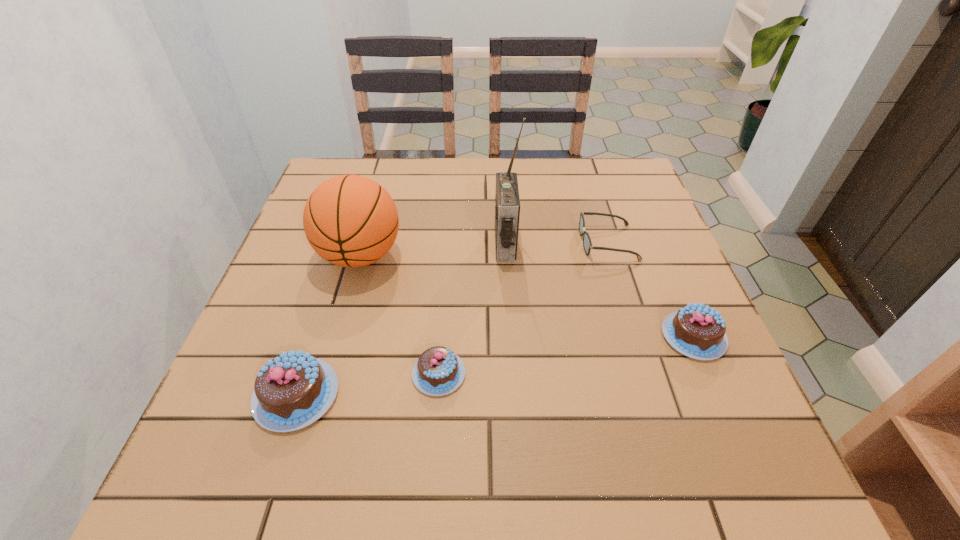
Where is `vacant space that is in between the spectacles and the second tallest chocolate cake`? Image resolution: width=960 pixels, height=540 pixels. vacant space that is in between the spectacles and the second tallest chocolate cake is located at coordinates (651, 289).

Find the location of a particular element. vacant space in between the spectacles and the rightmost chocolate cake is located at coordinates (651, 289).

The width and height of the screenshot is (960, 540). What are the coordinates of `empty location between the fourth shortest object and the basketball` in the screenshot? It's located at (328, 325).

I want to click on vacant area that lies between the radio receiver and the spectacles, so click(x=557, y=243).

This screenshot has width=960, height=540. What are the coordinates of `empty location between the third object from right to left and the spectacles` in the screenshot? It's located at (557, 243).

Find the location of a particular element. The width and height of the screenshot is (960, 540). free space between the third object from left to right and the leftmost chocolate cake is located at coordinates (368, 384).

Where is `vacant space that's between the spectacles and the radio receiver`? vacant space that's between the spectacles and the radio receiver is located at coordinates (557, 243).

The height and width of the screenshot is (540, 960). I want to click on empty space that is in between the third object from right to left and the second chocolate cake from left to right, so click(472, 309).

Locate an element on the screen. This screenshot has height=540, width=960. empty location between the spectacles and the third object from left to right is located at coordinates (523, 308).

In order to click on object that stands as the fifth closest to the spectacles in this screenshot , I will do (293, 390).